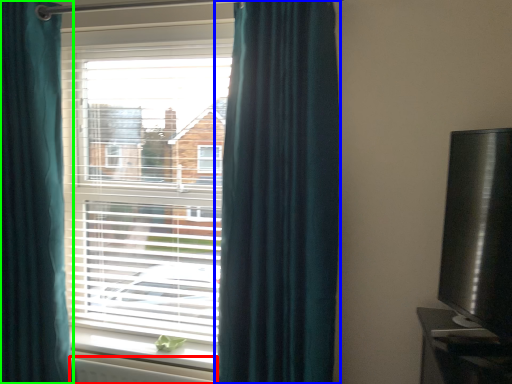
Question: Which object is the closest to the radiator (highlighted by a red box)? Choose among these: curtain (highlighted by a blue box) or curtain (highlighted by a green box).

Choices:
 (A) curtain
 (B) curtain

Answer: (B)